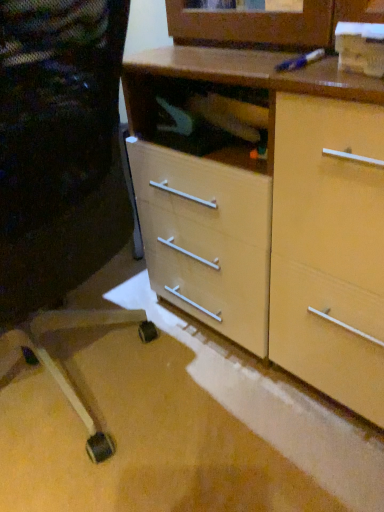
Measure the distance between matte wood chest of drawers at center and camera.

matte wood chest of drawers at center is 60.48 centimeters from camera.

At what (x,y) coordinates should I click in order to perform the action: click on matte wood chest of drawers at center. Please return your answer as a coordinate pair (x, y). Looking at the image, I should click on (272, 216).

Measure the distance between point (344, 383) and camera.

A distance of 36.61 inches exists between point (344, 383) and camera.

The height and width of the screenshot is (512, 384). Describe the element at coordinates (272, 216) in the screenshot. I see `matte wood chest of drawers at center` at that location.

Locate an element on the screen. The image size is (384, 512). matte black chair at lower left is located at coordinates (60, 170).

Image resolution: width=384 pixels, height=512 pixels. What do you see at coordinates (60, 170) in the screenshot?
I see `matte black chair at lower left` at bounding box center [60, 170].

Locate an element on the screen. matte wood chest of drawers at center is located at coordinates (272, 216).

Would you say matte black chair at lower left is to the left or to the right of matte wood chest of drawers at center in the picture?

From the image, it's evident that matte black chair at lower left is to the left of matte wood chest of drawers at center.

In the image, is matte black chair at lower left positioned in front of or behind matte wood chest of drawers at center?

matte black chair at lower left is in front of matte wood chest of drawers at center.

Between point (74, 137) and point (214, 214), which one is positioned behind?

Point (214, 214)

From the image's perspective, which one is positioned higher, matte black chair at lower left or matte wood chest of drawers at center?

From the image's view, matte wood chest of drawers at center is above.

From a real-world perspective, which object stands above the other?

matte wood chest of drawers at center is physically above.

In terms of width, does matte black chair at lower left look wider or thinner when compared to matte wood chest of drawers at center?

matte black chair at lower left is wider than matte wood chest of drawers at center.

Considering the sizes of matte black chair at lower left and matte wood chest of drawers at center in the image, is matte black chair at lower left taller or shorter than matte wood chest of drawers at center?

Clearly, matte black chair at lower left is taller compared to matte wood chest of drawers at center.

Does matte black chair at lower left have a larger size compared to matte wood chest of drawers at center?

Yes, matte black chair at lower left is bigger than matte wood chest of drawers at center.

Would you say matte black chair at lower left is outside matte wood chest of drawers at center?

Absolutely, matte black chair at lower left is external to matte wood chest of drawers at center.

Is matte black chair at lower left far from matte wood chest of drawers at center?

No.

Could you tell me if matte black chair at lower left is facing matte wood chest of drawers at center?

No.

This screenshot has width=384, height=512. In order to click on computer chair below the matte wood chest of drawers at center (from a real-world perspective) in this screenshot , I will do point(60,170).

Considering the positions of objects matte wood chest of drawers at center and matte black chair at lower left in the image provided, who is more to the right, matte wood chest of drawers at center or matte black chair at lower left?

matte wood chest of drawers at center is more to the right.

In the image, is matte wood chest of drawers at center positioned in front of or behind matte black chair at lower left?

matte wood chest of drawers at center is positioned farther from the viewer than matte black chair at lower left.

Does point (265, 81) lie in front of point (66, 126)?

Yes, point (265, 81) is closer to viewer.

From the image's perspective, is matte wood chest of drawers at center positioned above or below matte black chair at lower left?

Based on their image positions, matte wood chest of drawers at center is located above matte black chair at lower left.

From a real-world perspective, is matte wood chest of drawers at center over matte black chair at lower left?

Yes, from a real-world perspective, matte wood chest of drawers at center is over matte black chair at lower left

Between matte wood chest of drawers at center and matte black chair at lower left, which one has smaller width?

Thinner between the two is matte wood chest of drawers at center.

Who is shorter, matte wood chest of drawers at center or matte black chair at lower left?

With less height is matte wood chest of drawers at center.

Who is bigger, matte wood chest of drawers at center or matte black chair at lower left?

matte black chair at lower left is bigger.

Is matte wood chest of drawers at center not within matte black chair at lower left?

Yes.

Is matte wood chest of drawers at center next to matte black chair at lower left and touching it?

matte wood chest of drawers at center is not next to matte black chair at lower left, and they're not touching.

Is matte wood chest of drawers at center oriented towards matte black chair at lower left?

Yes, matte wood chest of drawers at center is aimed at matte black chair at lower left.

Where is `computer chair below the matte wood chest of drawers at center (from the image's perspective)`? The width and height of the screenshot is (384, 512). computer chair below the matte wood chest of drawers at center (from the image's perspective) is located at coordinates (60, 170).

There is a matte black chair at lower left. Where is `the chest of drawers above it (from a real-world perspective)`? the chest of drawers above it (from a real-world perspective) is located at coordinates (272, 216).

The image size is (384, 512). In order to click on computer chair that appears below the matte wood chest of drawers at center (from a real-world perspective) in this screenshot , I will do `click(60, 170)`.